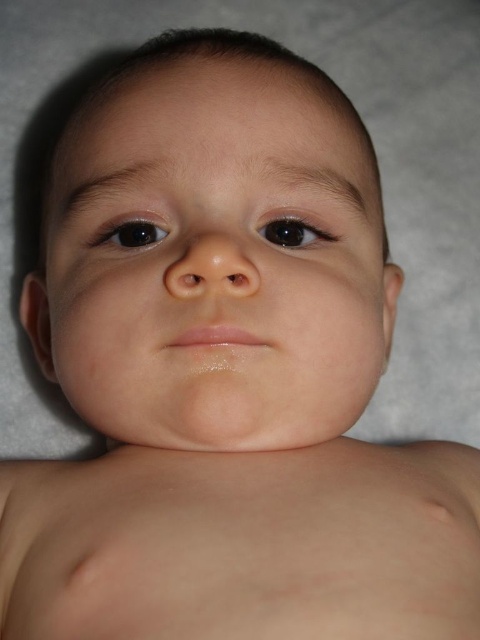
Is smooth skin face at center below black glossy eye at upper left?

Yes.

Image resolution: width=480 pixels, height=640 pixels. What do you see at coordinates (216, 260) in the screenshot? I see `smooth skin face at center` at bounding box center [216, 260].

This screenshot has height=640, width=480. I want to click on smooth skin face at center, so click(x=216, y=260).

Between black glossy eye at center and black glossy eye at upper left, which one appears on the right side from the viewer's perspective?

black glossy eye at center is more to the right.

Consider the image. Is the position of black glossy eye at center less distant than that of black glossy eye at upper left?

No, it is not.

Identify the location of black glossy eye at center. (292, 232).

The image size is (480, 640). Identify the location of black glossy eye at center. pyautogui.click(x=292, y=232).

Between smooth skin face at center and black glossy eye at center, which one has less height?

black glossy eye at center

At what (x,y) coordinates should I click in order to perform the action: click on smooth skin face at center. Please return your answer as a coordinate pair (x, y). This screenshot has width=480, height=640. Looking at the image, I should click on (216, 260).

Where is `smooth skin face at center`? The image size is (480, 640). smooth skin face at center is located at coordinates (216, 260).